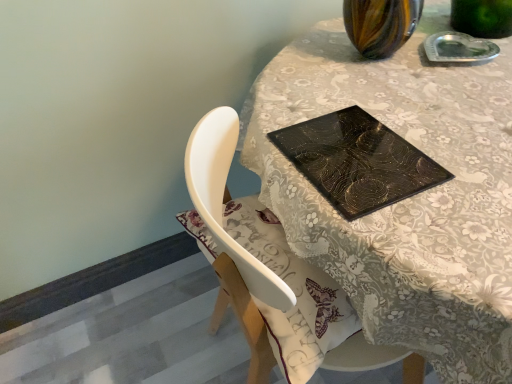
The height and width of the screenshot is (384, 512). In order to click on vacant area located to the right-hand side of black glossy placemat at upper center in this screenshot , I will do `click(440, 157)`.